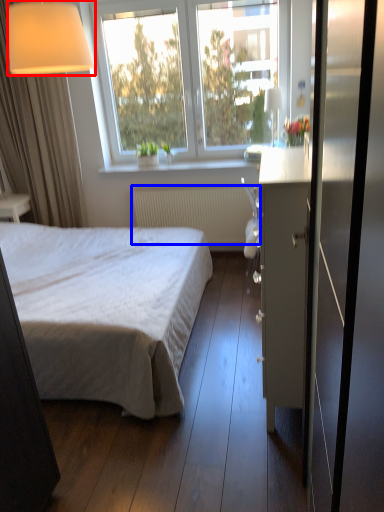
Question: Among these objects, which one is farthest to the camera, lamp (highlighted by a red box) or radiator (highlighted by a blue box)?

Choices:
 (A) lamp
 (B) radiator

Answer: (B)